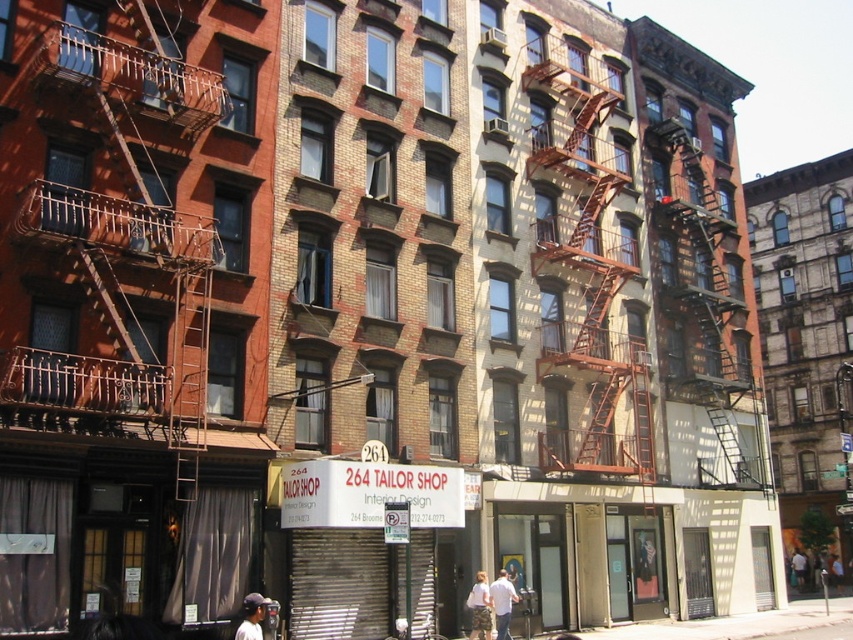
You are a delivery person who needs to drop off a package to the 264 Tailor Shop. The shop is located at the ground floor of the building with the fire escapes. Using the white cotton shirt at lower center as a reference point, can you determine the exact location of the 264 Tailor Shop on the building?

The white cotton shirt at lower center is located at point coordinates of (502, 602). Since the 264 Tailor Shop is at the ground floor of the building with fire escapes, you can find the shop by looking at the lower section of the building where the white cotton shirt at lower center is positioned.